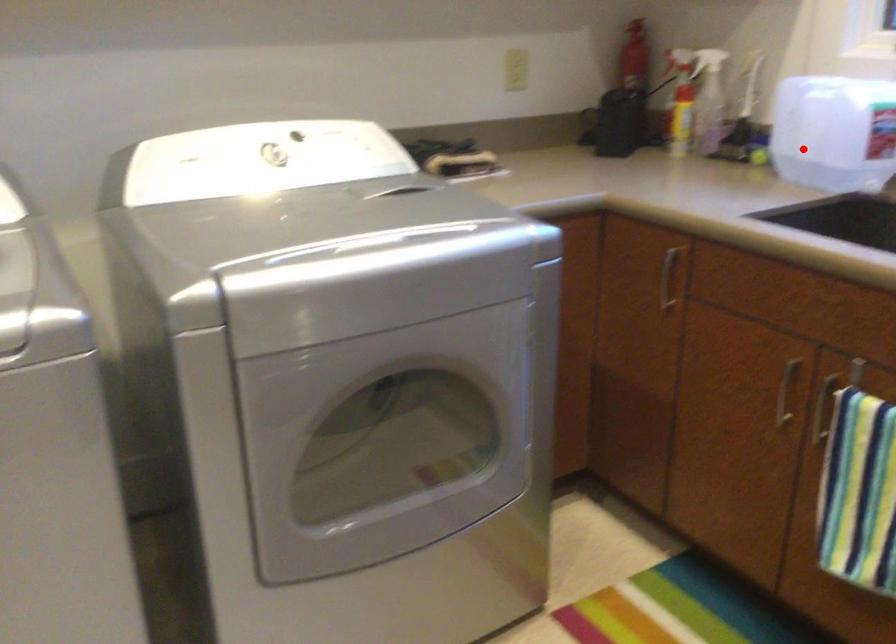
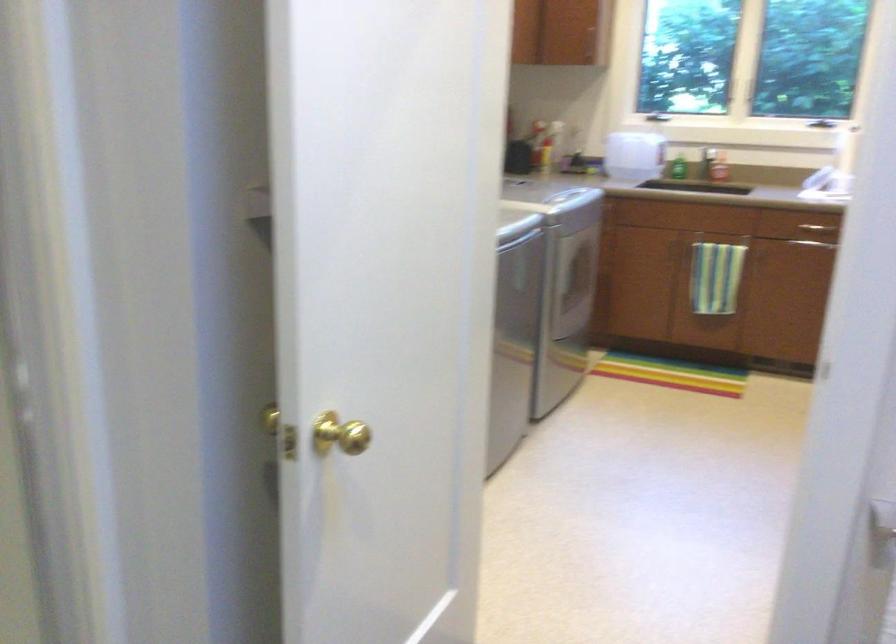
Question: I am providing you with two images of the same scene from different viewpoints. In image1, a red point is highlighted. Considering the same 3D point in image2, which of the following is correct?

Choices:
 (A) It is closer
 (B) It is farther

Answer: (B)